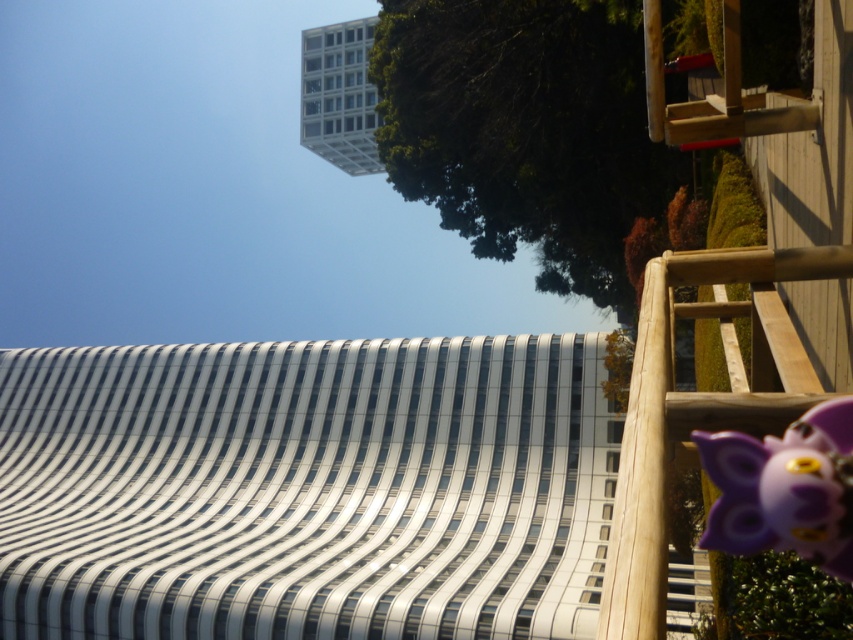
Does green leafy tree at upper center have a smaller size compared to purple matte toy at lower right?

Incorrect, green leafy tree at upper center is not smaller in size than purple matte toy at lower right.

Based on the photo, can you confirm if green leafy tree at upper center is positioned to the left of purple matte toy at lower right?

No, green leafy tree at upper center is not to the left of purple matte toy at lower right.

Which is in front, point (498, 141) or point (780, 506)?

Positioned in front is point (780, 506).

At what (x,y) coordinates should I click in order to perform the action: click on green leafy tree at upper center. Please return your answer as a coordinate pair (x, y). The height and width of the screenshot is (640, 853). Looking at the image, I should click on (525, 131).